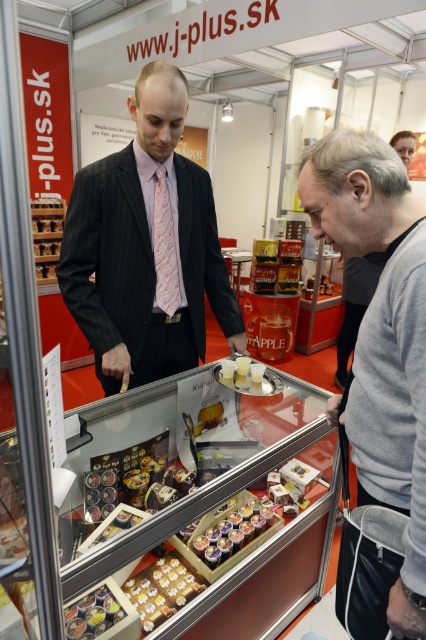
You are standing in front of the j plus.sk booth at the exhibition. There are two points marked in the scene. The first point is at coordinates point [195,532] and the second point is at point [95,620]. Which of these points is closer to you?

Point [195,532] is further to the camera than point [95,620], so the point closer to you is point [95,620].